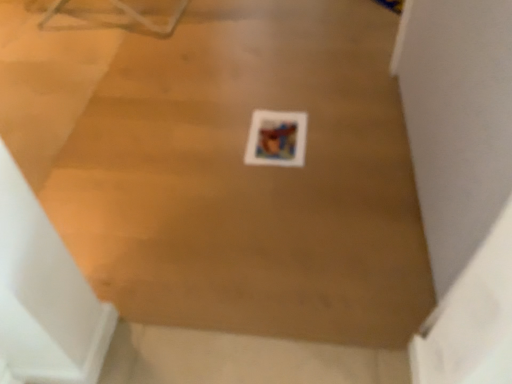
Locate an element on the screen. The image size is (512, 384). vacant space in front of matte paper print at center is located at coordinates (283, 185).